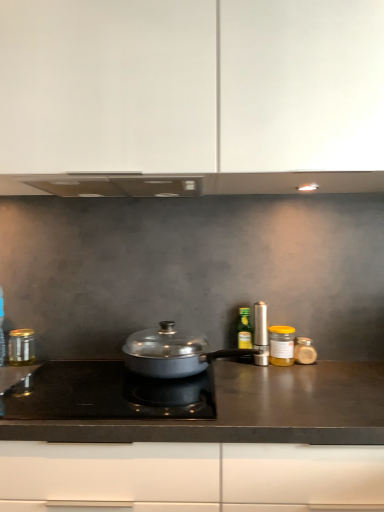
Identify the location of vacant point to the right of matte silver pan at center, which appears as the 5th kitchen appliance when viewed from the right. (308, 378).